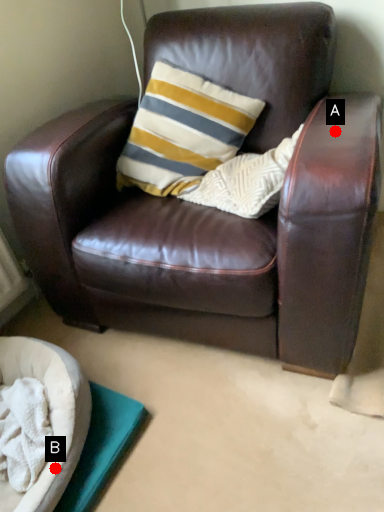
Question: Two points are circled on the image, labeled by A and B beside each circle. Which point is closer to the camera taking this photo?

Choices:
 (A) A is closer
 (B) B is closer

Answer: (A)